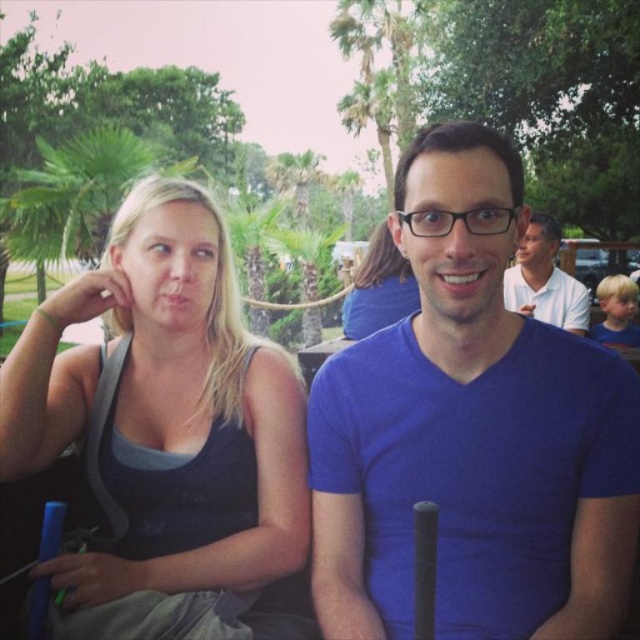
Question: Does blue matte shirt at center have a smaller size compared to white cotton polo shirt at upper right?

Choices:
 (A) yes
 (B) no

Answer: (A)

Question: Estimate the real-world distances between objects in this image. Which object is closer to the blue matte shirt at center?

Choices:
 (A) matte black tank top at center
 (B) white cotton polo shirt at upper right
 (C) matte blue tank top at center

Answer: (C)

Question: Does blue matte shirt at center have a larger size compared to matte black tank top at center?

Choices:
 (A) yes
 (B) no

Answer: (B)

Question: Which of the following is the farthest from the observer?

Choices:
 (A) matte black tank top at left
 (B) matte black tank top at center

Answer: (B)

Question: Which point is farther from the camera taking this photo?

Choices:
 (A) (541, 218)
 (B) (125, 609)
 (C) (358, 285)
 (D) (490, 131)

Answer: (A)

Question: Can you confirm if white cotton polo shirt at upper right is smaller than matte blue tank top at center?

Choices:
 (A) yes
 (B) no

Answer: (B)